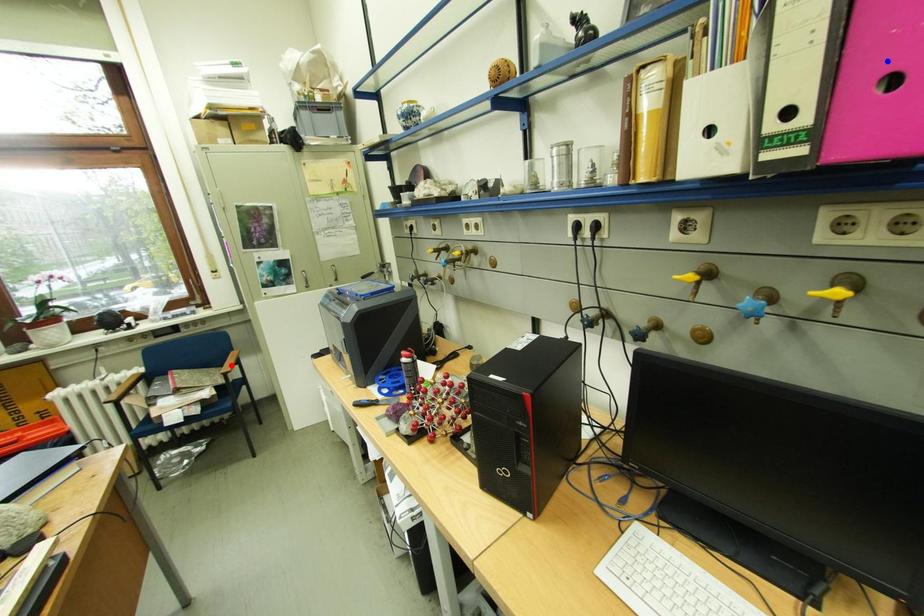
Question: Which of the two points in the image is closer to the camera?

Choices:
 (A) Blue point is closer.
 (B) Red point is closer.

Answer: (A)